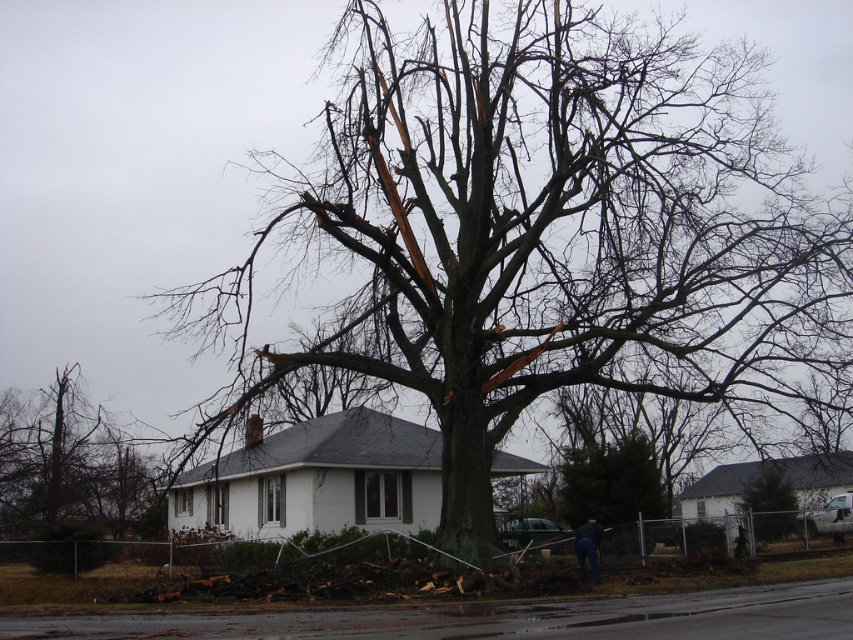
Does green textured tree at center have a lesser width compared to brown rough bark tree at center?

Indeed, green textured tree at center has a lesser width compared to brown rough bark tree at center.

Measure the distance between green textured tree at center and brown rough bark tree at center.

green textured tree at center and brown rough bark tree at center are 5.35 meters apart from each other.

Who is more forward, (607, 534) or (770, 536)?

Point (607, 534)

I want to click on green textured tree at center, so click(612, 486).

Which is more to the left, brown rough bark tree at center or dark blue jeans at lower center?

dark blue jeans at lower center is more to the left.

Between brown rough bark tree at center and dark blue jeans at lower center, which one appears on the right side from the viewer's perspective?

brown rough bark tree at center

Does point (747, 481) come behind point (581, 577)?

Yes, it is behind point (581, 577).

At what (x,y) coordinates should I click in order to perform the action: click on brown rough bark tree at center. Please return your answer as a coordinate pair (x, y). The image size is (853, 640). Looking at the image, I should click on (769, 500).

Between green textured tree at center and dark blue jeans at lower center, which one has less height?

dark blue jeans at lower center

This screenshot has height=640, width=853. In order to click on green textured tree at center in this screenshot , I will do `click(612, 486)`.

Where is `green textured tree at center`? This screenshot has width=853, height=640. green textured tree at center is located at coordinates click(612, 486).

Where is `green textured tree at center`? This screenshot has width=853, height=640. green textured tree at center is located at coordinates click(x=612, y=486).